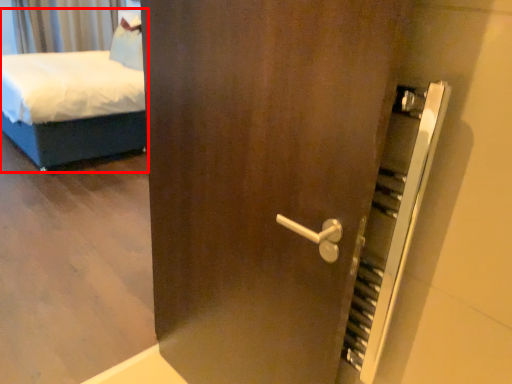
Question: From the image, what is the correct spatial relationship of bed (annotated by the red box) in relation to curtain?

Choices:
 (A) left
 (B) right

Answer: (B)